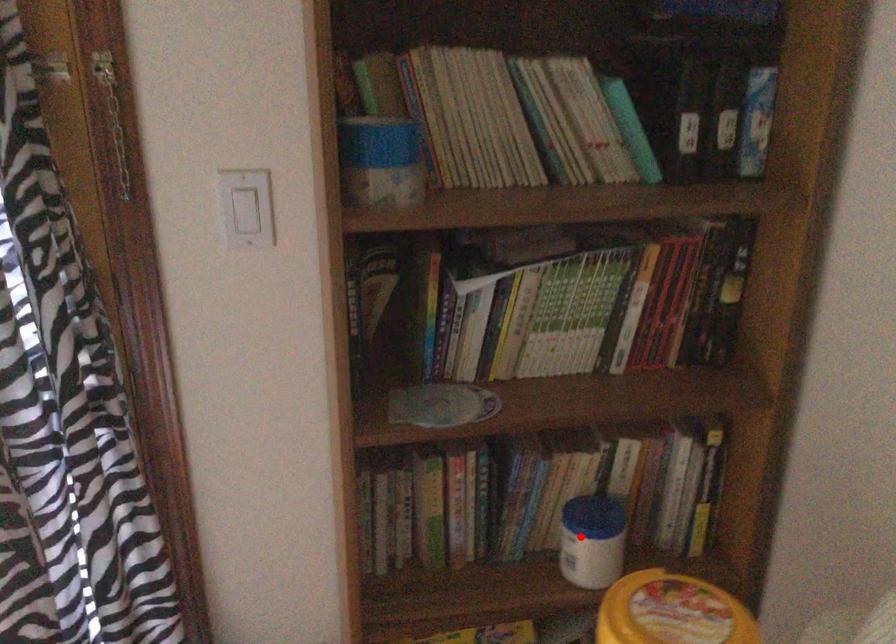
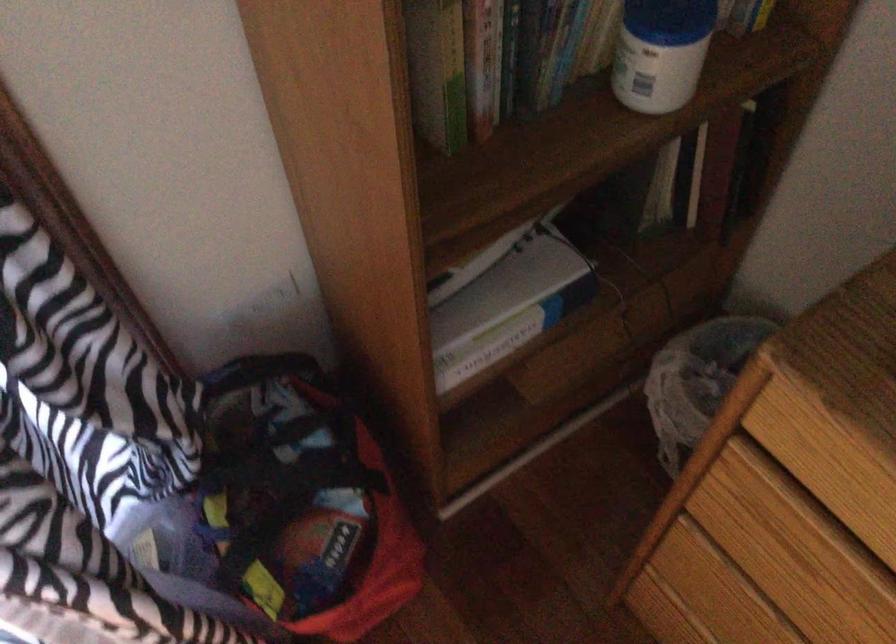
Where in the second image is the point corresponding to the highlighted location from the first image?

(660, 53)